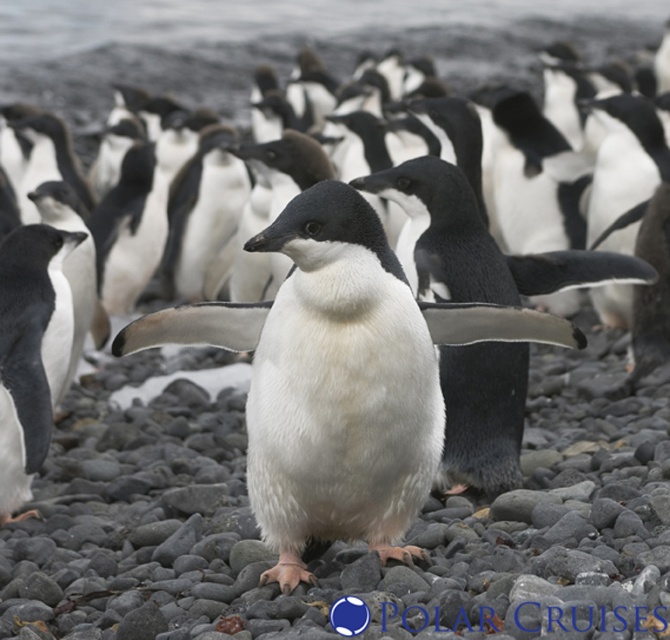
Based on the scene described, which penguin is positioned lower in the image, the white matte penguin at center or the white matte penguin at left?

The white matte penguin at center is positioned lower than the white matte penguin at left in the image.

You are a photographer standing on the rocky beach with the Adelie penguins. You want to take a photo that includes both the point at (291, 284) and the point at (17, 326). Which point should you focus on to ensure the foreground penguin is sharp?

You should focus on point (291, 284) because it is closer to the camera and aligns with the foreground penguin that needs to be sharp.

You are a wildlife photographer aiming to capture a photo of the white matte penguin at center and the white matte penguin at left. Your camera has a maximum focus range of 4 feet. Can you fit both penguins into the frame without moving the camera?

The white matte penguin at center and white matte penguin at left are 4.17 feet apart. Since your camera has a maximum focus range of 4 feet, the distance between them exceeds the camera capacity, so you cannot fit both penguins into the frame without moving the camera.